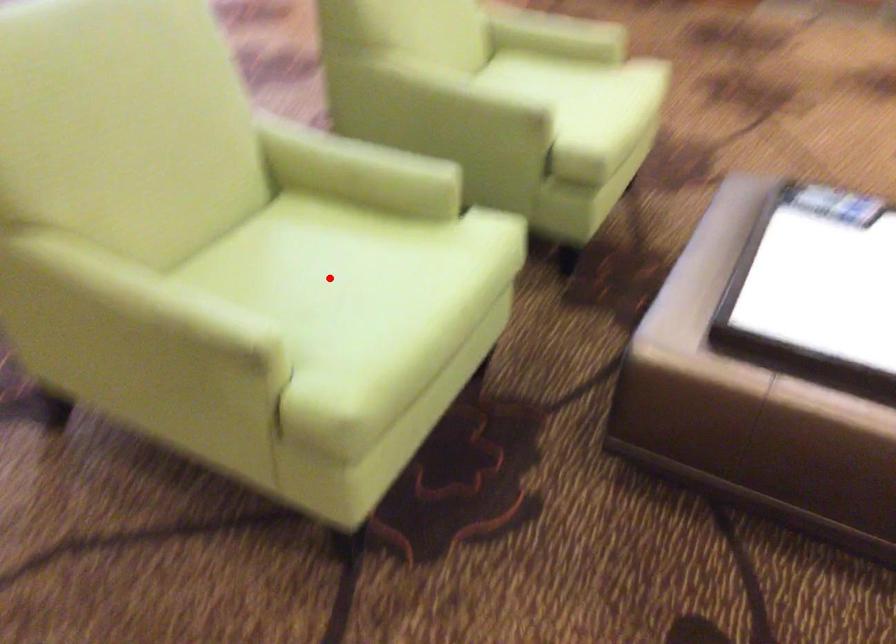
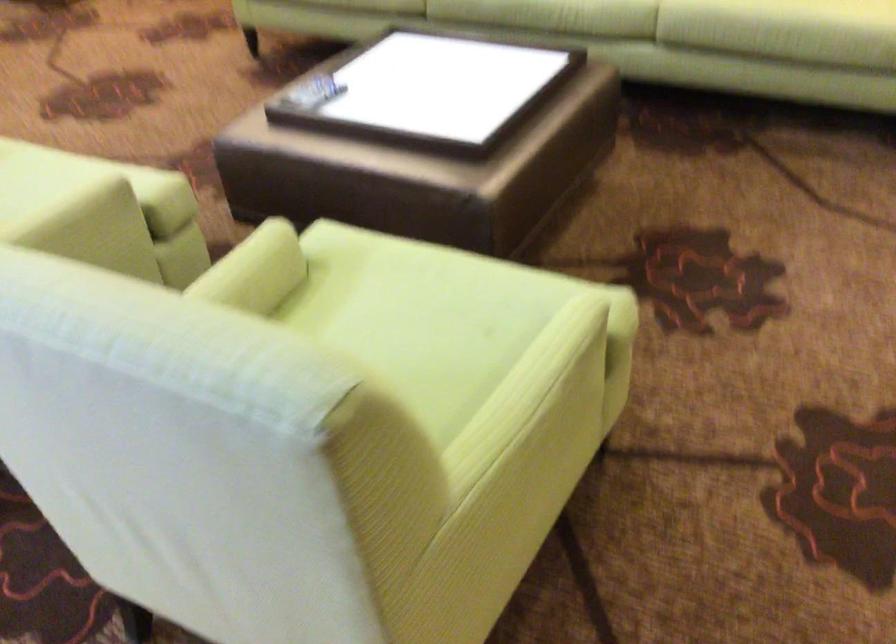
In the second image, find the point that corresponds to the highlighted location in the first image.

(410, 328)